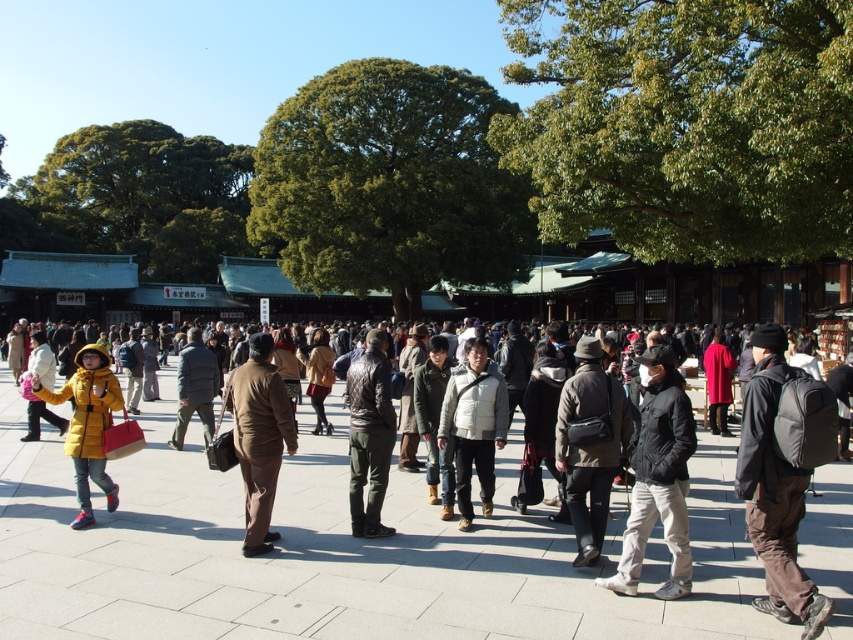
You are a tourist in the square and need to decide which item to pick up first. You see the dark gray backpack at lower right and the dark brown leather bag at center. Which one is bigger?

The dark gray backpack at lower right is larger in size compared to the dark brown leather bag at center.

You are a delivery robot with a 20 inch wide package. You need to navigate through the crowd in the public square and pass between the black matte jacket at center and the dark brown leather bag at center. Can you fit through the space between them without moving either object?

The distance between the black matte jacket at center and the dark brown leather bag at center is 19.87 inches. Since the package is 20 inches wide, it is slightly wider than the available space, so the robot cannot fit through the gap between them without moving either object.

You are a person standing at the edge of the square and want to pick up an item. You see the dark gray backpack at lower right and the dark brown leather bag at center. Which item is covering the other one?

The dark gray backpack at lower right is positioned over dark brown leather bag at center, so it is covering the dark brown leather bag at center.